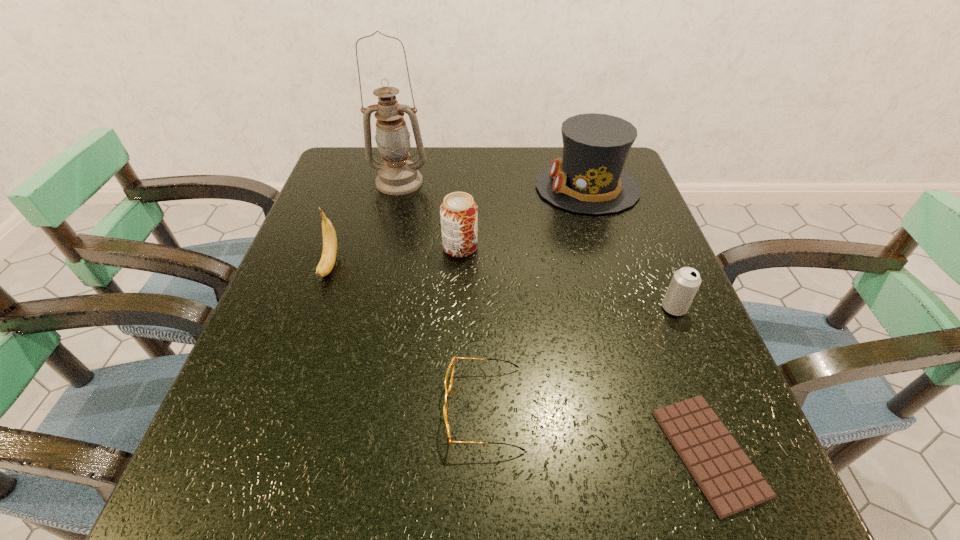
Locate an element on the screen. Image resolution: width=960 pixels, height=540 pixels. free location that satisfies the following two spatial constraints: 1. on the back side of the fifth farthest object; 2. with goggles on the front of the dress hat is located at coordinates (625, 188).

You are a GUI agent. You are given a task and a screenshot of the screen. Output one action in this format:
    pyautogui.click(x=<x>, y=<y>)
    Task: Click on the blank space that satisfies the following two spatial constraints: 1. on the front side of the shortest object; 2. on the right side of the tallest object
    
    Given the screenshot: What is the action you would take?
    pyautogui.click(x=336, y=453)

The width and height of the screenshot is (960, 540). What are the coordinates of `free spot that satisfies the following two spatial constraints: 1. on the front side of the shortest object; 2. on the right side of the left beer can` in the screenshot? It's located at (450, 453).